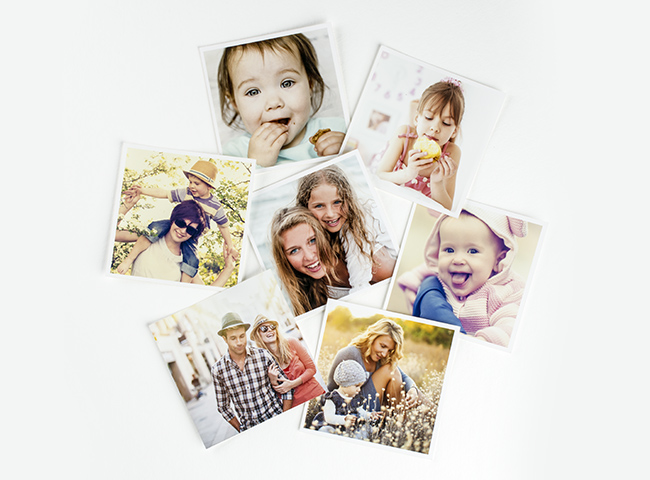
At what (x,y) coordinates should I click in order to perform the action: click on pictures in the collage. Please return your answer as a coordinate pair (x, y). This screenshot has width=650, height=480. Looking at the image, I should click on (257, 75), (419, 87), (471, 265), (318, 255), (188, 223), (247, 365), (361, 386).